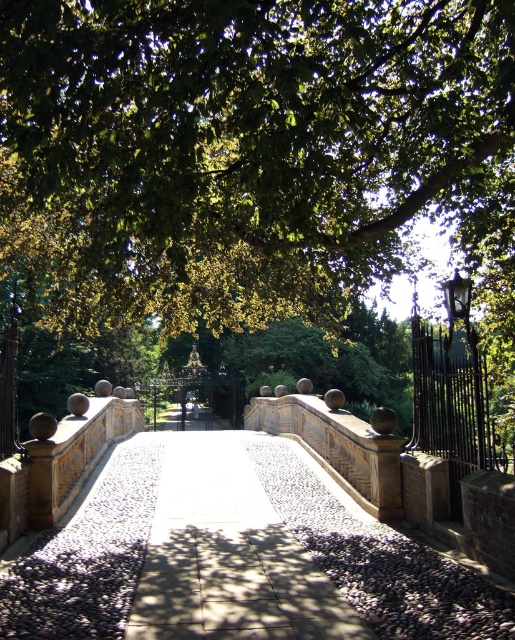
You are a gardener who needs to place a new flower pot between the white stone path at center and the black wrought iron fence at right. Based on their positions, which object should the flower pot be closer to?

The white stone path at center is positioned on the left side of black wrought iron fence at right, so the flower pot should be placed closer to the white stone path at center.

You are a painter standing on the cobblestone bridge and want to paint the green leafy tree at upper center and the black wrought iron fence at right. From your position on the bridge, which object is positioned to the left?

The green leafy tree at upper center is positioned to the left of the black wrought iron fence at right.